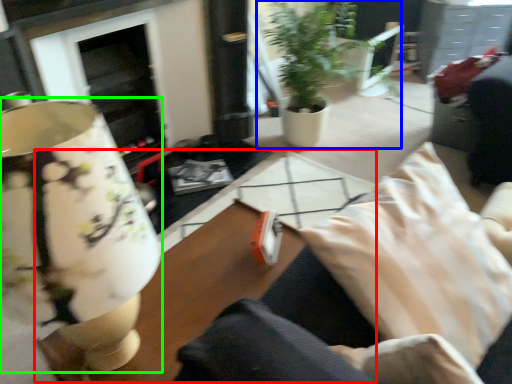
Question: Which object is positioned farthest from table (highlighted by a red box)? Select from houseplant (highlighted by a blue box) and table lamp (highlighted by a green box).

Choices:
 (A) houseplant
 (B) table lamp

Answer: (A)